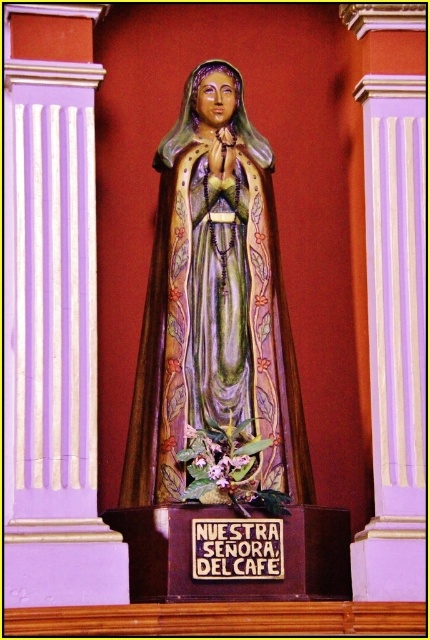
Can you confirm if polychrome wood statue at center is taller than wooden plaque at center?

Yes, polychrome wood statue at center is taller than wooden plaque at center.

Is polychrome wood statue at center closer to camera compared to wooden plaque at center?

No, polychrome wood statue at center is further to the viewer.

Who is more distant from viewer, (220,81) or (193,536)?

Point (220,81)

The width and height of the screenshot is (430, 640). I want to click on polychrome wood statue at center, so click(215, 301).